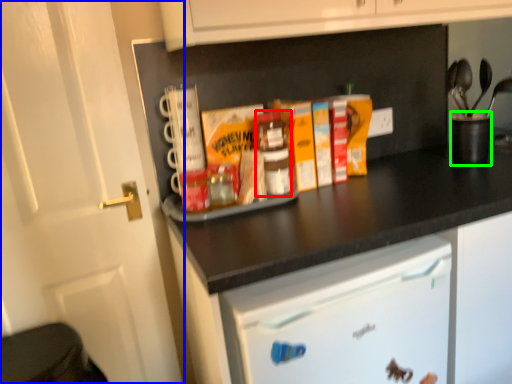
Question: Based on their relative distances, which object is nearer to bottle (highlighted by a red box)? Choose from door (highlighted by a blue box) and appliance (highlighted by a green box).

Choices:
 (A) door
 (B) appliance

Answer: (A)